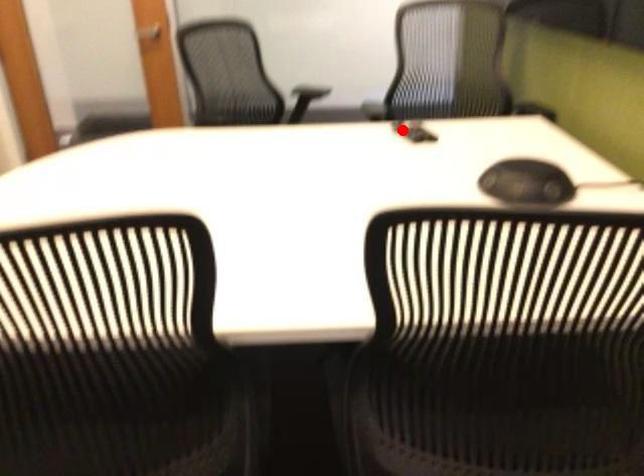
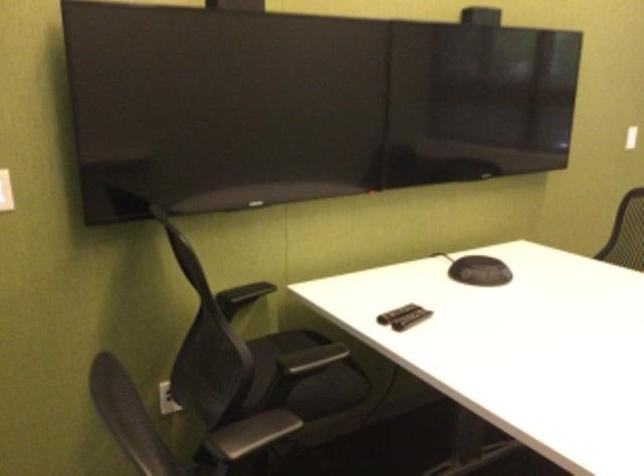
Find the pixel in the second image that matches the highlighted location in the first image.

(411, 319)